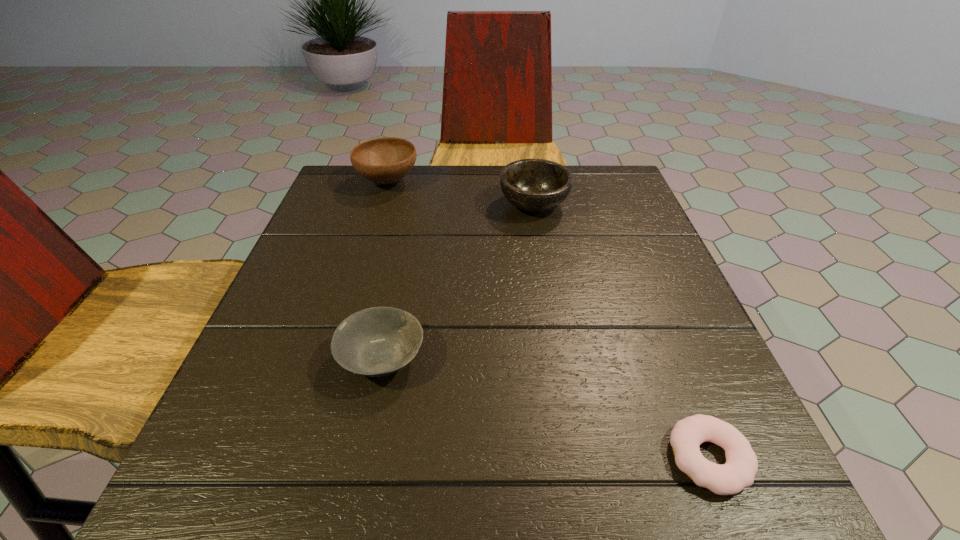
The image size is (960, 540). Identify the location of object present at the far left corner. (385, 160).

I want to click on object present at the near right corner, so click(741, 466).

This screenshot has width=960, height=540. In the image, there is a desktop. Find the location of `vacant region at the far edge`. vacant region at the far edge is located at coordinates (418, 193).

Identify the location of vacant area at the near edge. The width and height of the screenshot is (960, 540). (573, 519).

The width and height of the screenshot is (960, 540). In the image, there is a desktop. Find the location of `vacant region at the left edge`. vacant region at the left edge is located at coordinates (300, 387).

At what (x,y) coordinates should I click in order to perform the action: click on free location at the right edge. Please return your answer as a coordinate pair (x, y). The image size is (960, 540). Looking at the image, I should click on (636, 383).

Image resolution: width=960 pixels, height=540 pixels. Find the location of `vacant region at the far left corner of the desktop`. vacant region at the far left corner of the desktop is located at coordinates (334, 194).

This screenshot has width=960, height=540. I want to click on free spot at the near left corner of the desktop, so click(232, 477).

This screenshot has height=540, width=960. In order to click on vacant space at the far right corner of the desktop in this screenshot , I will do `click(621, 210)`.

This screenshot has height=540, width=960. In the image, there is a desktop. Find the location of `vacant space at the near right corner`. vacant space at the near right corner is located at coordinates (680, 517).